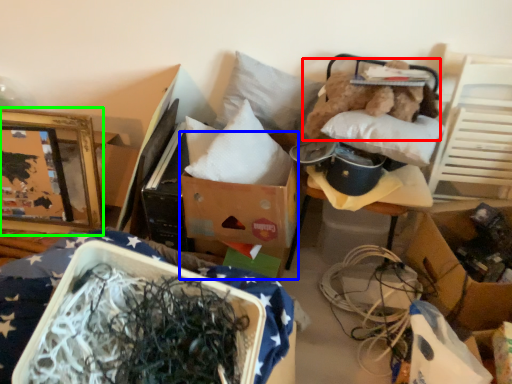
Question: Based on their relative distances, which object is farther from teddy (highlighted by a red box)? Choose from cardboard box (highlighted by a blue box) and picture frame (highlighted by a green box).

Choices:
 (A) cardboard box
 (B) picture frame

Answer: (B)